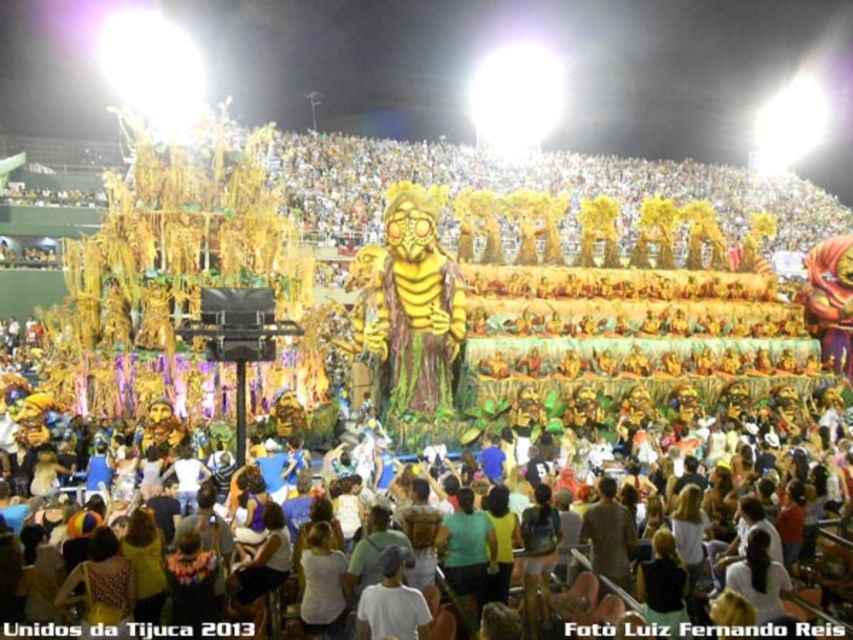
Is multicolored carnival costumes at center wider than gold metallic mask at center?

Indeed, multicolored carnival costumes at center has a greater width compared to gold metallic mask at center.

Is multicolored carnival costumes at center shorter than gold metallic mask at center?

Indeed, multicolored carnival costumes at center has a lesser height compared to gold metallic mask at center.

Identify the location of multicolored carnival costumes at center. click(486, 560).